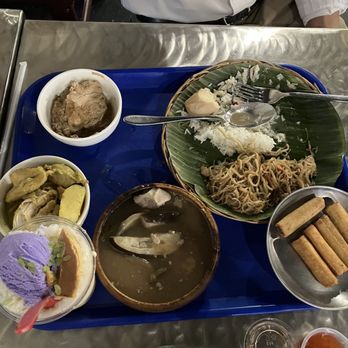
Locate an element on the screen. This screenshot has height=348, width=348. tray is located at coordinates (121, 154).